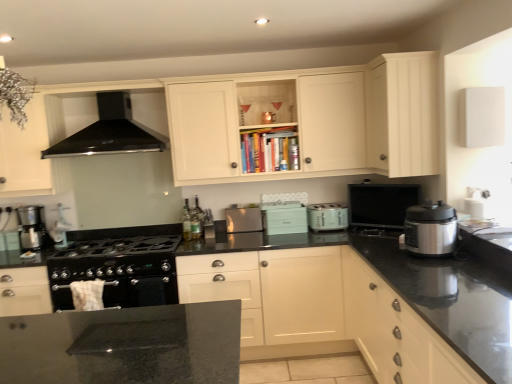
What do you see at coordinates (381, 205) in the screenshot? The image size is (512, 384). I see `matte black monitor at upper right, acting as the 1th appliance starting from the right` at bounding box center [381, 205].

How much space does light teal plastic toaster at center, the second appliance when ordered from right to left, occupy vertically?

9.66 inches.

Measure the distance between satin silver pressure cooker at right, positioned as the 1th kitchen appliance in right-to-left order, and camera.

2.41 meters.

The height and width of the screenshot is (384, 512). Describe the element at coordinates (110, 132) in the screenshot. I see `black matte range hood at upper left` at that location.

What are the coordinates of `white matte cabinet at upper right, marked as the 1th cabinetry in a top-to-bottom arrangement` in the screenshot? It's located at (402, 114).

What do you see at coordinates (31, 228) in the screenshot? The width and height of the screenshot is (512, 384). I see `metallic silver coffee maker at left, the 1th kitchen appliance in the left-to-right sequence` at bounding box center [31, 228].

How much space does satin silver toaster at center, which ranks as the second kitchen appliance in left-to-right order, occupy vertically?

The height of satin silver toaster at center, which ranks as the second kitchen appliance in left-to-right order, is 9.29 inches.

Where is `matte black monitor at upper right, which is counted as the second appliance, starting from the left`? matte black monitor at upper right, which is counted as the second appliance, starting from the left is located at coordinates (381, 205).

From the image's perspective, would you say satin silver pressure cooker at right, the 4th kitchen appliance in the back-to-front sequence, is positioned over matte white drawer at lower right, which is counted as the 3th cabinetry, starting from the top?

Yes, from the image's perspective, satin silver pressure cooker at right, the 4th kitchen appliance in the back-to-front sequence, is on top of matte white drawer at lower right, which is counted as the 3th cabinetry, starting from the top.

Is satin silver pressure cooker at right, which is the fourth kitchen appliance from left to right, bigger or smaller than matte white drawer at lower right, which is counted as the 3th cabinetry, starting from the top?

satin silver pressure cooker at right, which is the fourth kitchen appliance from left to right, is smaller than matte white drawer at lower right, which is counted as the 3th cabinetry, starting from the top.

In the scene shown: Does satin silver pressure cooker at right, positioned as the 1th kitchen appliance in right-to-left order, appear on the right side of matte white drawer at lower right, which is counted as the 3th cabinetry, starting from the top?

Yes.

Image resolution: width=512 pixels, height=384 pixels. In order to click on cabinetry that is the 1st object directly below the satin silver pressure cooker at right, the 4th kitchen appliance in the back-to-front sequence (from a real-world perspective) in this screenshot , I will do `click(395, 331)`.

From the image's perspective, between black matte range hood at upper left and white matte cabinet at center, the 4th cabinetry positioned from the top, which one is located above?

black matte range hood at upper left is shown above in the image.

Between black matte range hood at upper left and white matte cabinet at center, the 4th cabinetry positioned from the top, which one has larger size?

Bigger between the two is white matte cabinet at center, the 4th cabinetry positioned from the top.

At what (x,y) coordinates should I click in order to perform the action: click on the 3rd cabinetry in front when counting from the black matte range hood at upper left. Please return your answer as a coordinate pair (x, y). This screenshot has width=512, height=384. Looking at the image, I should click on (323, 310).

Which cabinetry is the 1st one when counting from the right side of the white matte cabinet at center, the first cabinetry positioned from the bottom? Please provide its 2D coordinates.

[(395, 331)]

From a real-world perspective, is matte white drawer at lower right, acting as the 2th cabinetry starting from the bottom, on top of white matte cabinet at center, the first cabinetry positioned from the bottom?

Indeed, from a real-world perspective, matte white drawer at lower right, acting as the 2th cabinetry starting from the bottom, stands above white matte cabinet at center, the first cabinetry positioned from the bottom.

Is matte white drawer at lower right, which is counted as the 3th cabinetry, starting from the top, situated inside white matte cabinet at center, the first cabinetry positioned from the bottom, or outside?

matte white drawer at lower right, which is counted as the 3th cabinetry, starting from the top, is spatially positioned inside white matte cabinet at center, the first cabinetry positioned from the bottom.

Does matte white drawer at lower right, acting as the 2th cabinetry starting from the bottom, come in front of white matte cabinet at center, the 4th cabinetry positioned from the top?

Yes, matte white drawer at lower right, acting as the 2th cabinetry starting from the bottom, is closer to the camera.

Starting from the satin silver pressure cooker at right, which is the first kitchen appliance in front-to-back order, which appliance is the 2nd one behind? Please provide its 2D coordinates.

[(284, 217)]

Is satin silver pressure cooker at right, which is the first kitchen appliance in front-to-back order, inside or outside of light teal plastic toaster at center, the second appliance when ordered from right to left?

satin silver pressure cooker at right, which is the first kitchen appliance in front-to-back order, is not inside light teal plastic toaster at center, the second appliance when ordered from right to left, it's outside.

What's the angular difference between satin silver pressure cooker at right, which is the fourth kitchen appliance from left to right, and light teal plastic toaster at center, the 1th appliance viewed from the left,'s facing directions?

The angle between the facing direction of satin silver pressure cooker at right, which is the fourth kitchen appliance from left to right, and the facing direction of light teal plastic toaster at center, the 1th appliance viewed from the left, is 87.5 degrees.

Between satin silver pressure cooker at right, which is the first kitchen appliance in front-to-back order, and light teal plastic toaster at center, the second appliance when ordered from right to left, which one has larger size?

Bigger between the two is satin silver pressure cooker at right, which is the first kitchen appliance in front-to-back order.

Could you measure the distance between satin silver toaster at center, which ranks as the second kitchen appliance in left-to-right order, and satin silver pressure cooker at right, which is the fourth kitchen appliance from left to right?

The distance of satin silver toaster at center, which ranks as the second kitchen appliance in left-to-right order, from satin silver pressure cooker at right, which is the fourth kitchen appliance from left to right, is 4.58 feet.

Considering the positions of point (229, 213) and point (412, 218), is point (229, 213) closer or farther from the camera than point (412, 218)?

Clearly, point (229, 213) is more distant from the camera than point (412, 218).

Can we say satin silver toaster at center, the 4th kitchen appliance viewed from the front, lies outside satin silver pressure cooker at right, which is the fourth kitchen appliance from left to right?

Yes, satin silver toaster at center, the 4th kitchen appliance viewed from the front, is outside of satin silver pressure cooker at right, which is the fourth kitchen appliance from left to right.

Considering the relative sizes of satin silver toaster at center, the 4th kitchen appliance viewed from the front, and satin silver pressure cooker at right, the 4th kitchen appliance in the back-to-front sequence, in the image provided, is satin silver toaster at center, the 4th kitchen appliance viewed from the front, shorter than satin silver pressure cooker at right, the 4th kitchen appliance in the back-to-front sequence,?

Correct, satin silver toaster at center, the 4th kitchen appliance viewed from the front, is not as tall as satin silver pressure cooker at right, the 4th kitchen appliance in the back-to-front sequence.

Is point (368, 87) positioned after point (35, 242)?

No.

From the white matte cabinet at upper right, marked as the 1th cabinetry in a top-to-bottom arrangement, count 1st kitchen appliances backward and point to it. Please provide its 2D coordinates.

[(31, 228)]

From the image's perspective, which one is positioned lower, white matte cabinet at upper right, marked as the 1th cabinetry in a top-to-bottom arrangement, or metallic silver coffee maker at left, acting as the 3th kitchen appliance starting from the back?

From the image's view, metallic silver coffee maker at left, acting as the 3th kitchen appliance starting from the back, is below.

In terms of width, does white matte cabinet at upper right, the fourth cabinetry when ordered from bottom to top, look wider or thinner when compared to metallic silver coffee maker at left, acting as the 3th kitchen appliance starting from the back?

white matte cabinet at upper right, the fourth cabinetry when ordered from bottom to top, is wider than metallic silver coffee maker at left, acting as the 3th kitchen appliance starting from the back.

Can you confirm if matte white drawer at lower right, acting as the 2th cabinetry starting from the bottom, is smaller than matte black monitor at upper right, acting as the 1th appliance starting from the right?

No, matte white drawer at lower right, acting as the 2th cabinetry starting from the bottom, is not smaller than matte black monitor at upper right, acting as the 1th appliance starting from the right.

From the image's perspective, does matte white drawer at lower right, acting as the 2th cabinetry starting from the bottom, appear higher than matte black monitor at upper right, which is counted as the second appliance, starting from the left?

No, from the image's perspective, matte white drawer at lower right, acting as the 2th cabinetry starting from the bottom, is not over matte black monitor at upper right, which is counted as the second appliance, starting from the left.

Between matte white drawer at lower right, which is counted as the 3th cabinetry, starting from the top, and matte black monitor at upper right, which is counted as the second appliance, starting from the left, which one has less height?

Standing shorter between the two is matte black monitor at upper right, which is counted as the second appliance, starting from the left.

Is matte white drawer at lower right, acting as the 2th cabinetry starting from the bottom, turned away from matte black monitor at upper right, acting as the 1th appliance starting from the right?

No, matte black monitor at upper right, acting as the 1th appliance starting from the right, is not at the back of matte white drawer at lower right, acting as the 2th cabinetry starting from the bottom.

Identify the location of cabinetry that is the 2nd one when counting forward from the satin silver pressure cooker at right, which is the first kitchen appliance in front-to-back order. (395, 331).

Where is `cabinetry that is the 2nd object to the right of the black matte range hood at upper left, starting at the anchor`? Image resolution: width=512 pixels, height=384 pixels. cabinetry that is the 2nd object to the right of the black matte range hood at upper left, starting at the anchor is located at coordinates (323, 310).

From the image, which object appears to be farther from matte white cabinet at upper center, acting as the second cabinetry starting from the top, white matte cabinet at upper right, the fourth cabinetry when ordered from bottom to top, or satin silver toaster at center, the 4th kitchen appliance viewed from the front?

The object further to matte white cabinet at upper center, acting as the second cabinetry starting from the top, is satin silver toaster at center, the 4th kitchen appliance viewed from the front.

Based on their spatial positions, is matte black monitor at upper right, which is counted as the second appliance, starting from the left, or black matte range hood at upper left closer to satin silver pressure cooker at right, positioned as the 1th kitchen appliance in right-to-left order?

matte black monitor at upper right, which is counted as the second appliance, starting from the left, lies closer to satin silver pressure cooker at right, positioned as the 1th kitchen appliance in right-to-left order, than the other object.

When comparing their distances from satin silver toaster at center, marked as the third kitchen appliance in a right-to-left arrangement, does matte silver toaster at center, which is counted as the third kitchen appliance, starting from the front, or black matte range hood at upper left seem further?

The object further to satin silver toaster at center, marked as the third kitchen appliance in a right-to-left arrangement, is black matte range hood at upper left.

Looking at the image, which one is located further to matte black monitor at upper right, which is counted as the second appliance, starting from the left, satin silver pressure cooker at right, the 4th kitchen appliance in the back-to-front sequence, or matte white cabinet at upper center, the 3th cabinetry positioned from the bottom?

satin silver pressure cooker at right, the 4th kitchen appliance in the back-to-front sequence.

From the image, which object appears to be farther from white matte cabinet at center, the 4th cabinetry positioned from the top, black matte range hood at upper left or metallic silver coffee maker at left, acting as the 3th kitchen appliance starting from the back?

metallic silver coffee maker at left, acting as the 3th kitchen appliance starting from the back, is positioned further to the anchor white matte cabinet at center, the 4th cabinetry positioned from the top.

Considering their positions, is white matte cabinet at center, the 4th cabinetry positioned from the top, positioned closer to satin silver toaster at center, the 4th kitchen appliance viewed from the front, than light teal plastic toaster at center, the 1th appliance viewed from the left?

light teal plastic toaster at center, the 1th appliance viewed from the left, is closer to satin silver toaster at center, the 4th kitchen appliance viewed from the front.

Looking at this image, estimate the real-world distances between objects in this image. Which object is closer to white matte cabinet at center, the first cabinetry positioned from the bottom, matte black monitor at upper right, which is counted as the second appliance, starting from the left, or light teal plastic toaster at center, the second appliance when ordered from right to left?

Based on the image, light teal plastic toaster at center, the second appliance when ordered from right to left, appears to be nearer to white matte cabinet at center, the first cabinetry positioned from the bottom.

When comparing their distances from white matte cabinet at center, the 4th cabinetry positioned from the top, does white matte cabinet at upper right, marked as the 1th cabinetry in a top-to-bottom arrangement, or metallic silver coffee maker at left, which is counted as the fourth kitchen appliance, starting from the right, seem further?

The object further to white matte cabinet at center, the 4th cabinetry positioned from the top, is metallic silver coffee maker at left, which is counted as the fourth kitchen appliance, starting from the right.

At what (x,y) coordinates should I click in order to perform the action: click on appliance between light teal plastic toaster at center, the second appliance when ordered from right to left, and white matte cabinet at upper right, the fourth cabinetry when ordered from bottom to top. Please return your answer as a coordinate pair (x, y). Looking at the image, I should click on (381, 205).

At what (x,y) coordinates should I click in order to perform the action: click on appliance between matte white drawer at lower right, acting as the 2th cabinetry starting from the bottom, and light teal plastic toaster at center, the second appliance when ordered from right to left, from front to back. Please return your answer as a coordinate pair (x, y). Image resolution: width=512 pixels, height=384 pixels. Looking at the image, I should click on (381, 205).

The height and width of the screenshot is (384, 512). In order to click on kitchen appliance situated between black matte range hood at upper left and light teal plastic toaster at center, the 1th appliance viewed from the left, from left to right in this screenshot , I will do `click(243, 220)`.

You are a GUI agent. You are given a task and a screenshot of the screen. Output one action in this format:
    pyautogui.click(x=<x>, y=<y>)
    Task: Click on the appliance located between satin silver pressure cooker at right, which is the fourth kitchen appliance from left to right, and matte silver toaster at center, which ranks as the 2th kitchen appliance in right-to-left order, in the depth direction
    Image resolution: width=512 pixels, height=384 pixels.
    Given the screenshot: What is the action you would take?
    pyautogui.click(x=381, y=205)